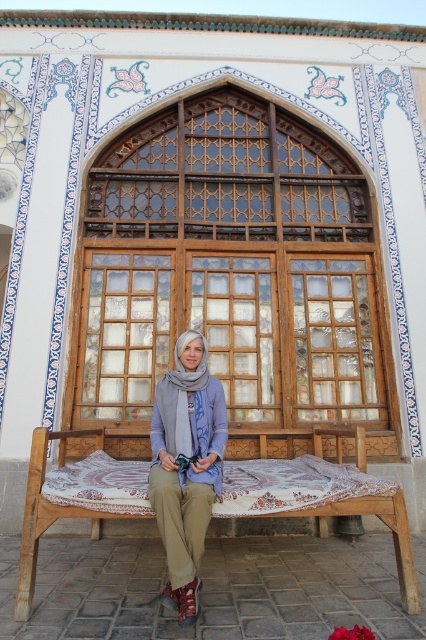
Which is below, wooden bench with patterned cushion at center or gray soft scarf at center?

Positioned lower is wooden bench with patterned cushion at center.

Does wooden bench with patterned cushion at center appear under gray soft scarf at center?

Yes, wooden bench with patterned cushion at center is below gray soft scarf at center.

Who is more forward, (282, 493) or (206, 448)?

Point (282, 493)

Locate an element on the screen. This screenshot has height=640, width=426. wooden bench with patterned cushion at center is located at coordinates click(71, 500).

Between matte gray scarf at center and gray soft scarf at center, which one appears on the right side from the viewer's perspective?

From the viewer's perspective, matte gray scarf at center appears more on the right side.

Which of these two, matte gray scarf at center or gray soft scarf at center, stands shorter?

Standing shorter between the two is gray soft scarf at center.

Is point (170, 413) closer to viewer compared to point (184, 444)?

No, (170, 413) is behind (184, 444).

Identify the location of matte gray scarf at center. coord(186,467).

Who is taller, wooden bench with patterned cushion at center or matte gray scarf at center?

matte gray scarf at center is taller.

Find the location of a particular element. This screenshot has width=426, height=640. wooden bench with patterned cushion at center is located at coordinates (71, 500).

Identify the location of wooden bench with patterned cushion at center. Image resolution: width=426 pixels, height=640 pixels. (71, 500).